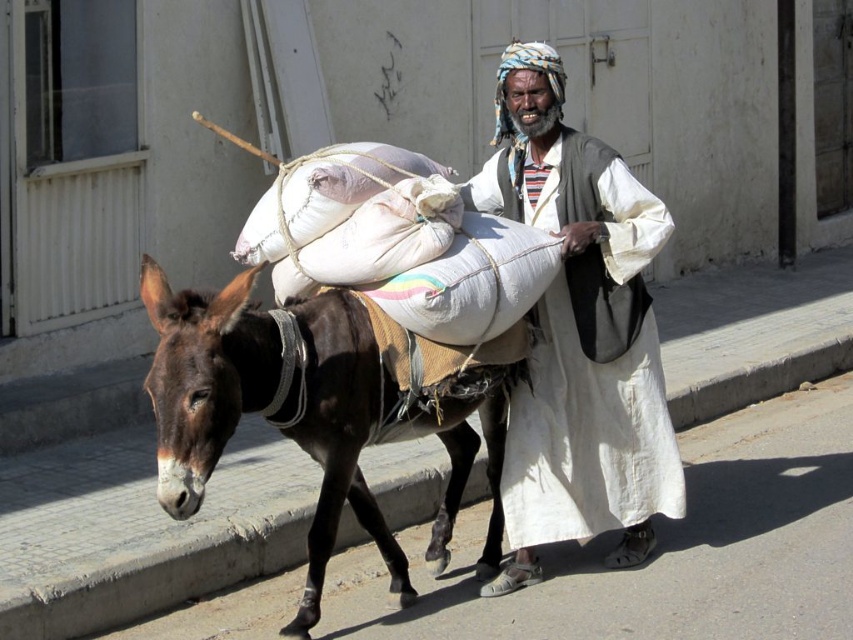
Question: Is white cotton dress at center wider than brown rough skin mule at center?

Choices:
 (A) no
 (B) yes

Answer: (A)

Question: In this image, where is white cotton dress at center located relative to brown rough skin mule at center?

Choices:
 (A) below
 (B) above

Answer: (B)

Question: Can you confirm if white cotton dress at center is positioned to the left of brown rough skin mule at center?

Choices:
 (A) no
 (B) yes

Answer: (A)

Question: Which of the following is the closest to the observer?

Choices:
 (A) (310, 561)
 (B) (511, 445)

Answer: (A)

Question: Which point is farther from the camera taking this photo?

Choices:
 (A) (303, 348)
 (B) (662, 380)

Answer: (B)